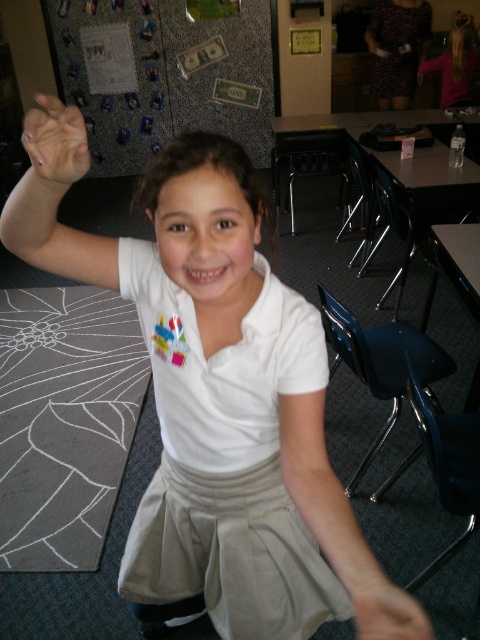
Question: Which of these objects is positioned closest to the matte white arm at upper left?

Choices:
 (A) white cotton dress at center
 (B) printed fabric dress at upper right

Answer: (A)

Question: Is white cotton dress at center smaller than smooth skin hand at lower right?

Choices:
 (A) yes
 (B) no

Answer: (B)

Question: In this image, where is white chalk drawing at lower left located relative to white fabric arm at lower center?

Choices:
 (A) above
 (B) below

Answer: (B)

Question: Which point is farther from the camera taking this photo?

Choices:
 (A) pyautogui.click(x=46, y=122)
 (B) pyautogui.click(x=403, y=49)
 (C) pyautogui.click(x=350, y=524)
 (D) pyautogui.click(x=385, y=595)

Answer: (B)

Question: Is white cotton dress at center to the right of smooth skin hand at lower right from the viewer's perspective?

Choices:
 (A) yes
 (B) no

Answer: (B)

Question: Which object appears farthest from the camera in this image?

Choices:
 (A) white fabric arm at lower center
 (B) matte white arm at upper left
 (C) smooth skin hand at lower right

Answer: (B)